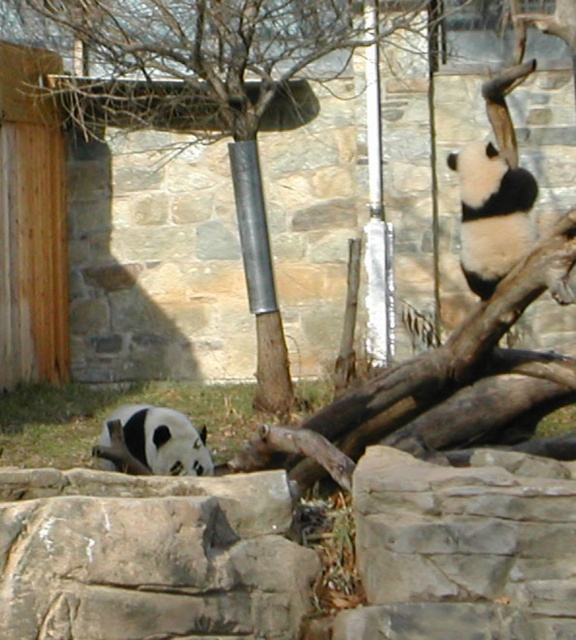
Question: Which point is farther to the camera?

Choices:
 (A) (157, 422)
 (B) (153, 106)

Answer: (B)

Question: Can you confirm if smooth brown tree trunk at center is positioned below black and white fur panda at lower left?

Choices:
 (A) yes
 (B) no

Answer: (B)

Question: Which object is positioned closest to the black and white fur at upper right?

Choices:
 (A) black and white fur panda at lower left
 (B) smooth brown tree trunk at center

Answer: (A)

Question: Does smooth brown tree trunk at center have a lesser width compared to black and white fur panda at lower left?

Choices:
 (A) yes
 (B) no

Answer: (B)

Question: Which point is farther from the camera taking this photo?

Choices:
 (A) (456, 166)
 (B) (183, 444)
 (C) (267, 19)

Answer: (C)

Question: Where is smooth brown tree trunk at center located in relation to black and white fur panda at lower left in the image?

Choices:
 (A) right
 (B) left

Answer: (A)